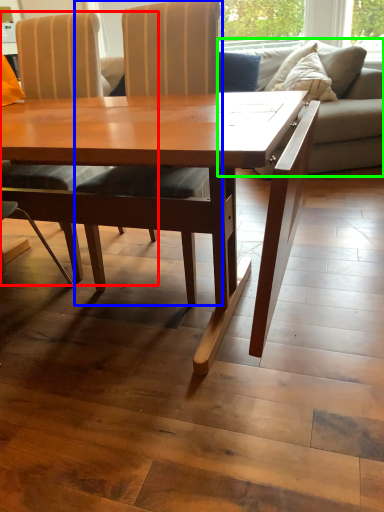
Question: Based on their relative distances, which object is farther from chair (highlighted by a red box)? Choose from chair (highlighted by a blue box) and studio couch (highlighted by a green box).

Choices:
 (A) chair
 (B) studio couch

Answer: (B)